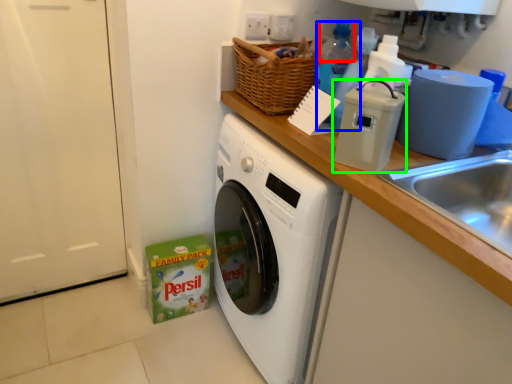
Question: Estimate the real-world distances between objects in this image. Which object is farther from bottle (highlighted by a red box), bottle (highlighted by a blue box) or appliance (highlighted by a green box)?

Choices:
 (A) bottle
 (B) appliance

Answer: (B)